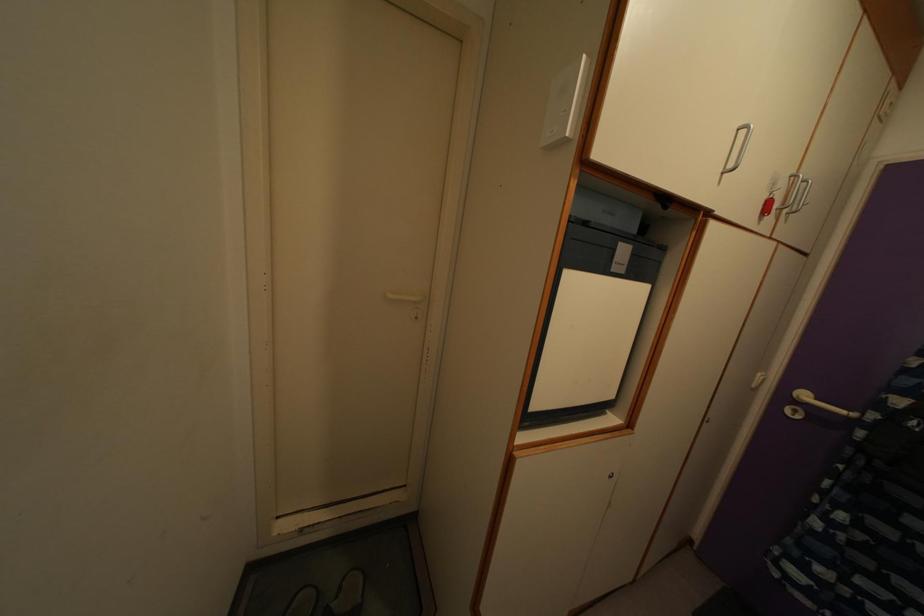
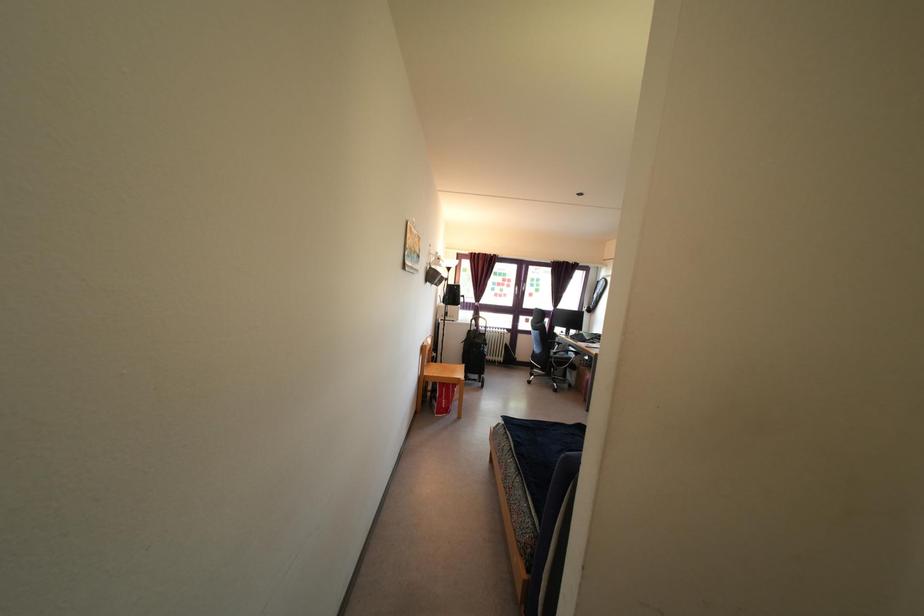
Question: How did the camera likely rotate?

Choices:
 (A) Left
 (B) Right
 (C) Up
 (D) Down

Answer: (A)